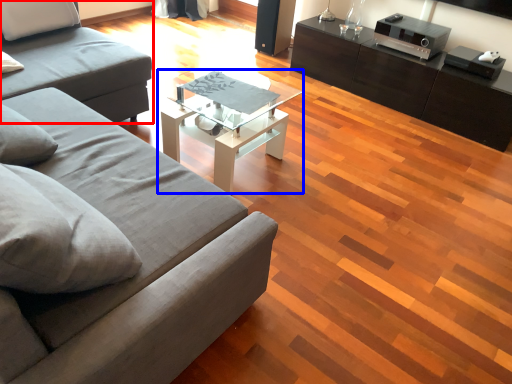
Question: Among these objects, which one is nearest to the camera, studio couch (highlighted by a red box) or coffee table (highlighted by a blue box)?

Choices:
 (A) studio couch
 (B) coffee table

Answer: (A)